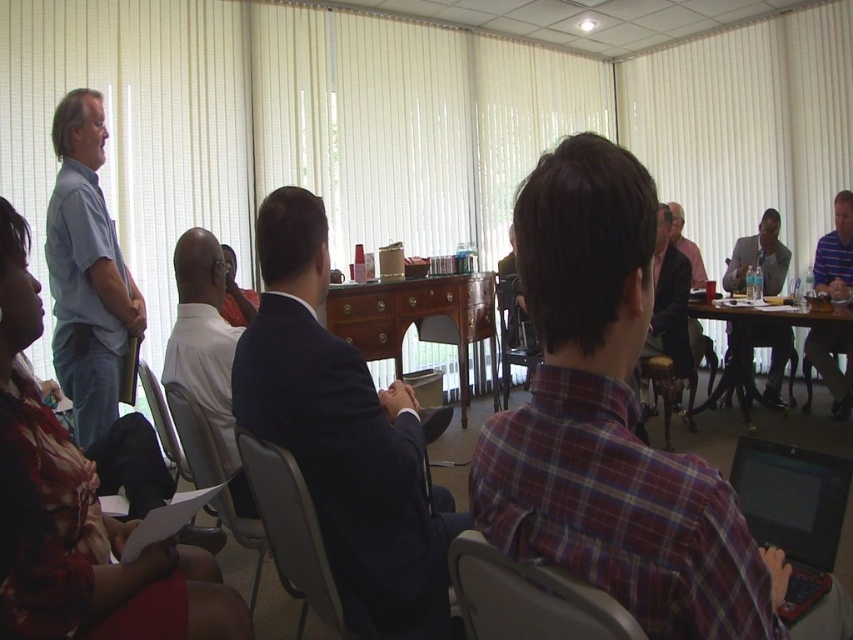
Does gray plastic chair at center have a lesser height compared to light gray suit at right?

Correct, gray plastic chair at center is not as tall as light gray suit at right.

Can you confirm if gray plastic chair at center is wider than light gray suit at right?

Incorrect, gray plastic chair at center's width does not surpass light gray suit at right's.

The height and width of the screenshot is (640, 853). What are the coordinates of `gray plastic chair at center` in the screenshot? It's located at (289, 531).

Does pink fabric shirt at center appear on the right side of wooden chair at center?

No, pink fabric shirt at center is not to the right of wooden chair at center.

Is point (668, 236) closer to viewer compared to point (645, 356)?

No, it is not.

Identify the location of pink fabric shirt at center. Image resolution: width=853 pixels, height=640 pixels. (670, 304).

Can you confirm if wooden table at center is shorter than pink fabric shirt at center?

Indeed, wooden table at center has a lesser height compared to pink fabric shirt at center.

Based on the photo, how much distance is there between wooden table at center and pink fabric shirt at center?

A distance of 28.86 inches exists between wooden table at center and pink fabric shirt at center.

Between point (741, 340) and point (677, 250), which one is positioned in front?

Point (677, 250) is more forward.

Locate an element on the screen. Image resolution: width=853 pixels, height=640 pixels. wooden table at center is located at coordinates (751, 342).